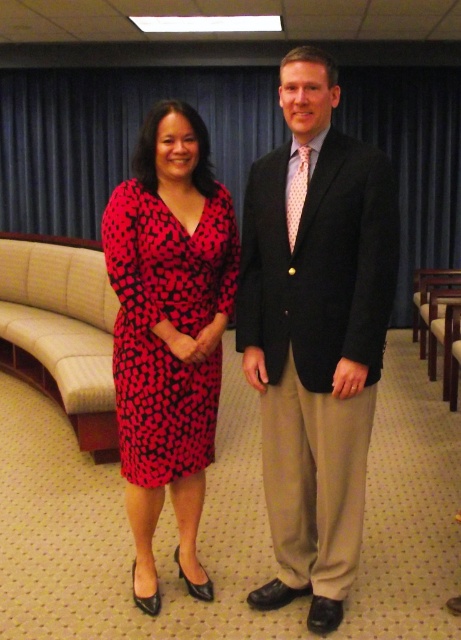
Between matte black suit at center and red dotted fabric dress at center, which one has less height?

red dotted fabric dress at center

Is matte black suit at center above red dotted fabric dress at center?

Incorrect, matte black suit at center is not positioned above red dotted fabric dress at center.

Is point (318, 458) closer to camera compared to point (148, 193)?

Yes, it is in front of point (148, 193).

At what (x,y) coordinates should I click in order to perform the action: click on matte black suit at center. Please return your answer as a coordinate pair (x, y). Looking at the image, I should click on (314, 332).